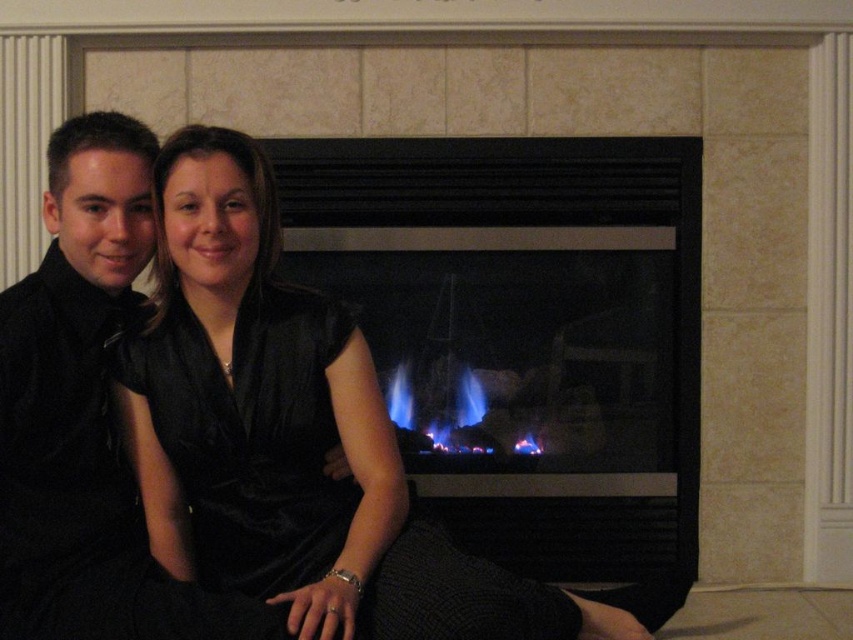
Find the location of a particular element. The height and width of the screenshot is (640, 853). blue glass fireplace at center is located at coordinates (524, 332).

Between blue glass fireplace at center and blue flames at center, which one has less height?

blue flames at center is shorter.

What do you see at coordinates (524, 332) in the screenshot? I see `blue glass fireplace at center` at bounding box center [524, 332].

Find the location of a particular element. blue glass fireplace at center is located at coordinates (524, 332).

Is velvet black dress at center thinner than blue flames at center?

No, velvet black dress at center is not thinner than blue flames at center.

Does velvet black dress at center have a lesser height compared to blue flames at center?

No.

What are the coordinates of `velvet black dress at center` in the screenshot? It's located at (251, 433).

Who is higher up, velvet black dress at center or black velvet shirt at left?

black velvet shirt at left is higher up.

The width and height of the screenshot is (853, 640). What are the coordinates of `velvet black dress at center` in the screenshot? It's located at (251, 433).